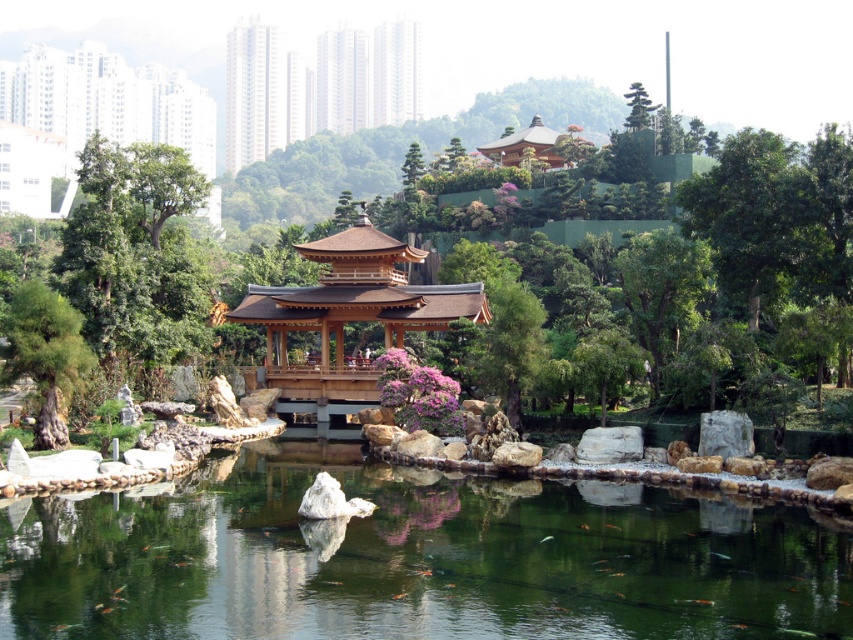
You are an architect designing a new garden layout. You need to place a tall statue that requires a space taller than the green leafy tree at upper right. Can the natural wood gazebo at center accommodate this statue? Please explain based on their heights.

The green leafy tree at upper right is taller than the natural wood gazebo at center. Therefore, the natural wood gazebo at center cannot accommodate the statue since it is shorter than the required height based on the tree.

You are standing on the rocky shoreline and want to walk to the wooden pagoda at upper center. Which direction should you go to avoid stepping into the clear water at pond center?

To avoid stepping into the clear water at pond center, you should walk towards the wooden pagoda at upper center while staying on the rocky shoreline since the clear water at pond center is closer to you than the wooden pagoda at upper center.